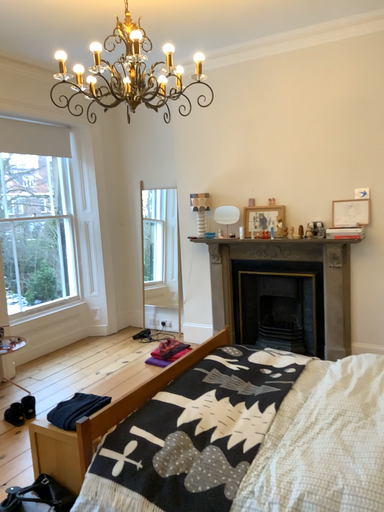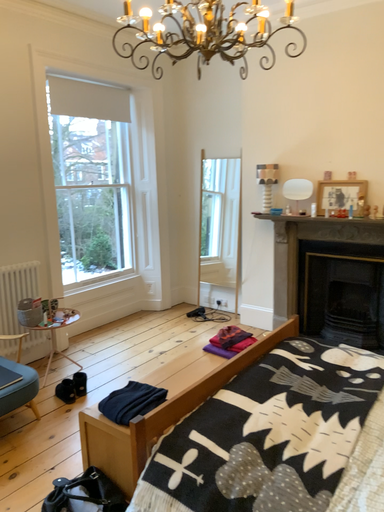
Question: Which way did the camera rotate in the video?

Choices:
 (A) rotated left
 (B) rotated right

Answer: (A)